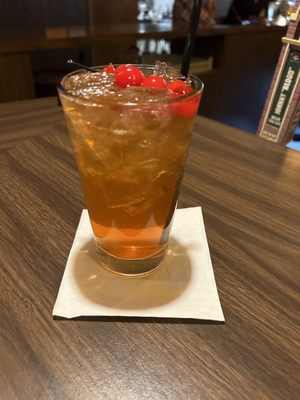
At what (x,y) coordinates should I click in order to perform the action: click on back table. Please return your answer as a coordinate pair (x, y). Looking at the image, I should click on (125, 30).